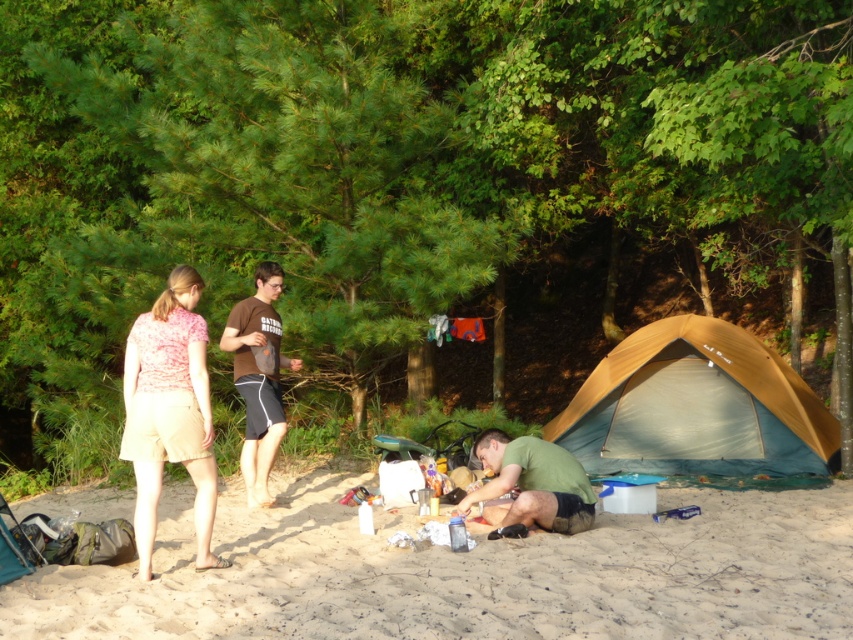
Does pink fabric shorts at lower left appear under green matte shirt at lower center?

No.

Is point (152, 476) farther from camera compared to point (521, 492)?

No, it is not.

Between point (190, 474) and point (482, 449), which one is positioned behind?

Positioned behind is point (482, 449).

Identify the location of pink fabric shorts at lower left. The height and width of the screenshot is (640, 853). pyautogui.click(x=169, y=412).

Can you confirm if fine-grained sand at lower center is positioned below brown cotton t-shirt at center?

Yes.

Is point (476, 609) positioned behind point (270, 435)?

No.

Where is `fine-grained sand at lower center`? The width and height of the screenshot is (853, 640). fine-grained sand at lower center is located at coordinates (463, 573).

Between point (759, 429) and point (473, 492), which one is positioned in front?

Point (473, 492)

I want to click on tan fabric tent at lower right, so click(695, 406).